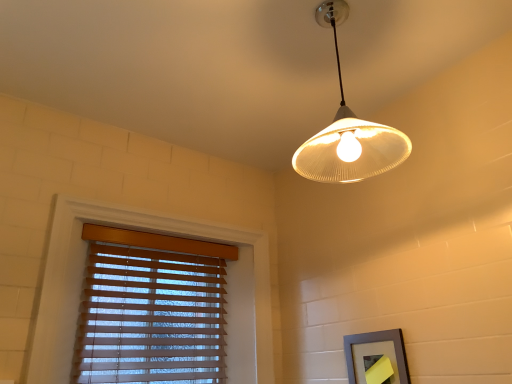
Question: Considering the relative sizes of gray matte picture frame at lower right and white ribbed glass lampshade at upper center in the image provided, is gray matte picture frame at lower right thinner than white ribbed glass lampshade at upper center?

Choices:
 (A) no
 (B) yes

Answer: (B)

Question: Is gray matte picture frame at lower right positioned far away from white ribbed glass lampshade at upper center?

Choices:
 (A) no
 (B) yes

Answer: (A)

Question: Can you confirm if gray matte picture frame at lower right is smaller than white ribbed glass lampshade at upper center?

Choices:
 (A) yes
 (B) no

Answer: (A)

Question: Is gray matte picture frame at lower right oriented away from white ribbed glass lampshade at upper center?

Choices:
 (A) yes
 (B) no

Answer: (B)

Question: From a real-world perspective, is gray matte picture frame at lower right under white ribbed glass lampshade at upper center?

Choices:
 (A) yes
 (B) no

Answer: (A)

Question: Is the depth of gray matte picture frame at lower right less than that of white ribbed glass lampshade at upper center?

Choices:
 (A) no
 (B) yes

Answer: (A)

Question: Is wooden blinds at lower left next to white ribbed glass lampshade at upper center and touching it?

Choices:
 (A) yes
 (B) no

Answer: (B)

Question: From the image's perspective, is wooden blinds at lower left below white ribbed glass lampshade at upper center?

Choices:
 (A) no
 (B) yes

Answer: (B)

Question: Is white ribbed glass lampshade at upper center surrounded by wooden blinds at lower left?

Choices:
 (A) no
 (B) yes

Answer: (A)

Question: Considering the relative positions of wooden blinds at lower left and white ribbed glass lampshade at upper center in the image provided, is wooden blinds at lower left to the right of white ribbed glass lampshade at upper center from the viewer's perspective?

Choices:
 (A) no
 (B) yes

Answer: (A)

Question: From a real-world perspective, is wooden blinds at lower left on top of white ribbed glass lampshade at upper center?

Choices:
 (A) yes
 (B) no

Answer: (B)

Question: Is wooden blinds at lower left at the left side of white ribbed glass lampshade at upper center?

Choices:
 (A) yes
 (B) no

Answer: (A)

Question: Considering the relative sizes of white ribbed glass lampshade at upper center and gray matte picture frame at lower right in the image provided, is white ribbed glass lampshade at upper center thinner than gray matte picture frame at lower right?

Choices:
 (A) no
 (B) yes

Answer: (A)